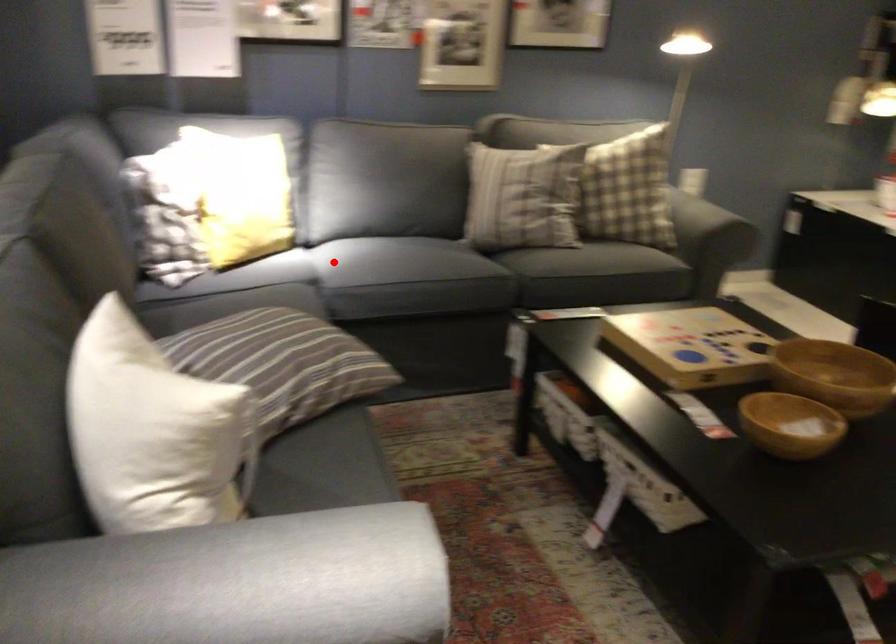
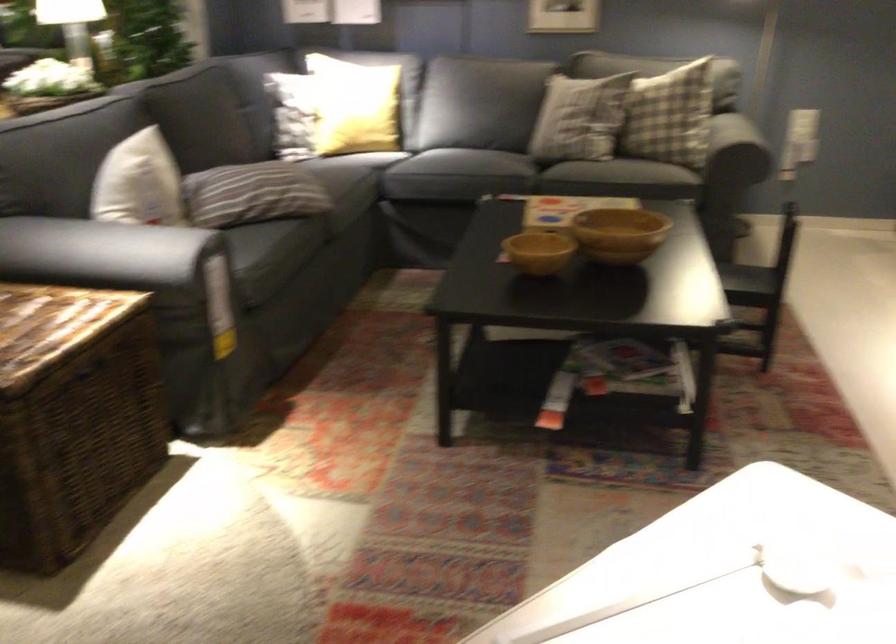
Locate, in the second image, the point that corresponds to the highlighted location in the first image.

(386, 149)